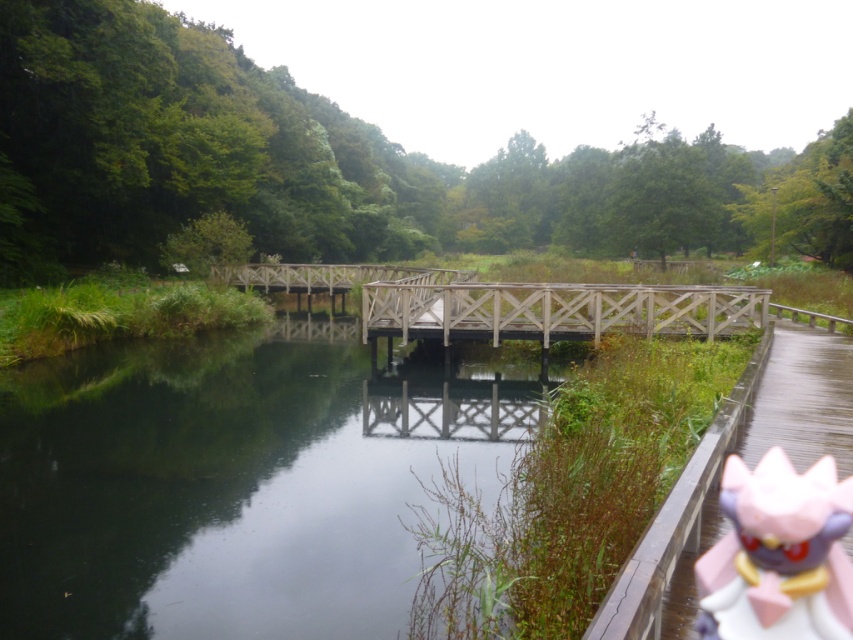
Measure the distance between dark reflective water at center and pink plastic doll at lower right.

dark reflective water at center and pink plastic doll at lower right are 11.25 meters apart.

Does dark reflective water at center appear under pink plastic doll at lower right?

Indeed, dark reflective water at center is positioned under pink plastic doll at lower right.

Is point (62, 360) closer to camera compared to point (781, 593)?

No, (62, 360) is further to viewer.

Find the location of a particular element. dark reflective water at center is located at coordinates click(231, 483).

Consider the image. Which is more to the left, pink plastic doll at lower right or wooden bridge at center?

From the viewer's perspective, pink plastic doll at lower right appears more on the left side.

Can you confirm if pink plastic doll at lower right is wider than wooden bridge at center?

No, pink plastic doll at lower right is not wider than wooden bridge at center.

Is point (712, 611) behind point (625, 312)?

No.

Find the location of a particular element. Image resolution: width=853 pixels, height=640 pixels. pink plastic doll at lower right is located at coordinates (778, 554).

Which is above, dark reflective water at center or wooden bridge at center?

wooden bridge at center is higher up.

Is dark reflective water at center below wooden bridge at center?

Correct, dark reflective water at center is located below wooden bridge at center.

At what (x,y) coordinates should I click in order to perform the action: click on dark reflective water at center. Please return your answer as a coordinate pair (x, y). Looking at the image, I should click on (231, 483).

The width and height of the screenshot is (853, 640). I want to click on dark reflective water at center, so click(231, 483).